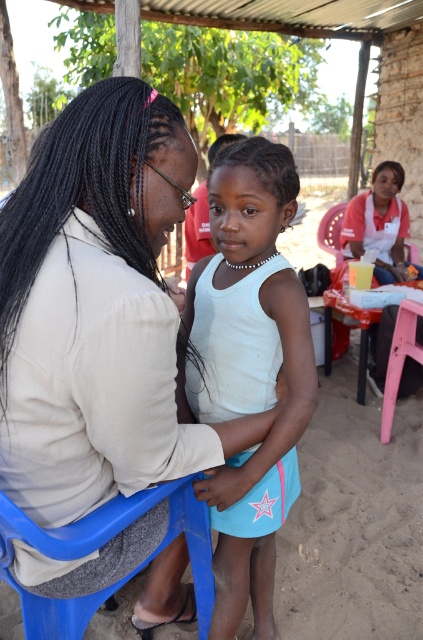
Is point (247, 586) in front of point (364, 365)?

Yes, point (247, 586) is closer to viewer.

Image resolution: width=423 pixels, height=640 pixels. Identify the location of white matte tank top at center. (249, 321).

Does point (106, 513) come farther from viewer compared to point (409, 336)?

That is False.

Is blue plastic chair at lower left taller than pink plastic picnic table at lower right?

No.

Measure the distance between point [24,634] and camera.

Point [24,634] is 3.69 feet from camera.

The image size is (423, 640). Find the location of `blue plastic chair at lower left`. blue plastic chair at lower left is located at coordinates (98, 547).

Does point (224, 541) come in front of point (353, 221)?

Yes, it is in front of point (353, 221).

Identify the location of white matte tank top at center. (249, 321).

The height and width of the screenshot is (640, 423). I want to click on white matte tank top at center, so click(249, 321).